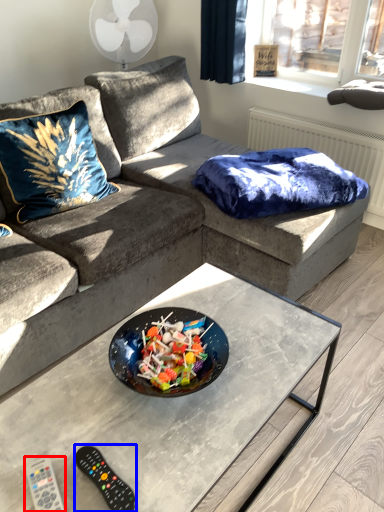
Question: Which object is closer to the camera taking this photo, remote (highlighted by a red box) or remote (highlighted by a blue box)?

Choices:
 (A) remote
 (B) remote

Answer: (A)